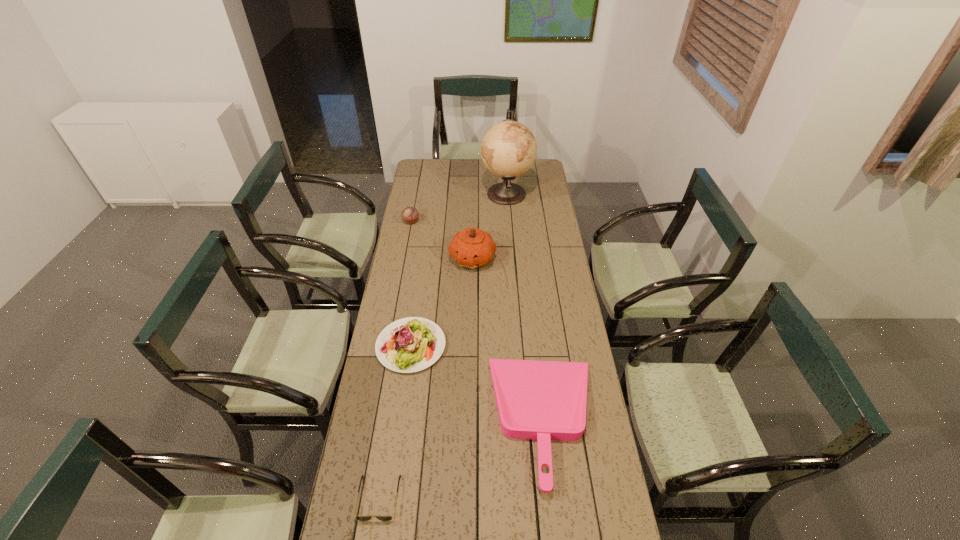
Locate an element on the screen. Image resolution: width=960 pixels, height=540 pixels. vacant position located on the front-facing side of the globe is located at coordinates (462, 193).

The height and width of the screenshot is (540, 960). I want to click on free spot located on the front-facing side of the globe, so click(415, 193).

You are a GUI agent. You are given a task and a screenshot of the screen. Output one action in this format:
    pyautogui.click(x=<x>, y=<y>)
    Task: Click on the free space located 0.330m on the front-facing side of the pumpkin
    
    Given the screenshot: What is the action you would take?
    pyautogui.click(x=471, y=333)

Where is `free space located on the back of the muffin`? This screenshot has height=540, width=960. free space located on the back of the muffin is located at coordinates (419, 180).

I want to click on vacant space located 0.190m on the front of the salad plate, so click(x=399, y=425).

Locate an element on the screen. Image resolution: width=960 pixels, height=540 pixels. blank space located on the handle side of the dustpan is located at coordinates (435, 420).

Locate an element on the screen. vacant space located on the handle side of the dustpan is located at coordinates (444, 420).

The image size is (960, 540). In order to click on vacant area situated on the handle side of the dustpan in this screenshot , I will do `click(444, 420)`.

Where is `object located at the far edge`? object located at the far edge is located at coordinates (508, 149).

This screenshot has height=540, width=960. I want to click on muffin located in the left edge section of the desktop, so click(410, 214).